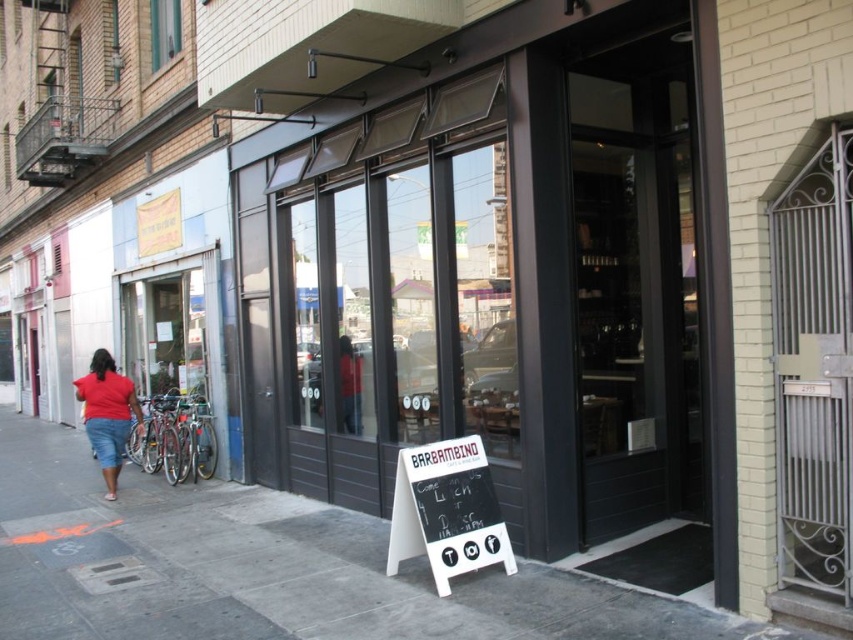
You are a painter who needs to know which object is taller between the matte black storefront at center and the white wood sign at center. Based on the scene, which one is taller?

The matte black storefront at center is taller than the white wood sign at center.

You are a delivery person who needs to attach a package to the white wood sign at center and the matte red shirt at center. Which object can you attach a larger package to without exceeding its width?

The white wood sign at center has a greater width than the matte red shirt at center, so you can attach a larger package to the white wood sign at center without exceeding its width.

You are standing in front of the store and want to take a photo of both the matte black storefront at center and the matte red shirt at left. Which object should you focus on first to ensure both are in focus?

You should focus on the matte black storefront at center first because it is closer to you than the matte red shirt at left. By focusing on the closer object, the farther one may still be in the depth of field, ensuring both are sharp.